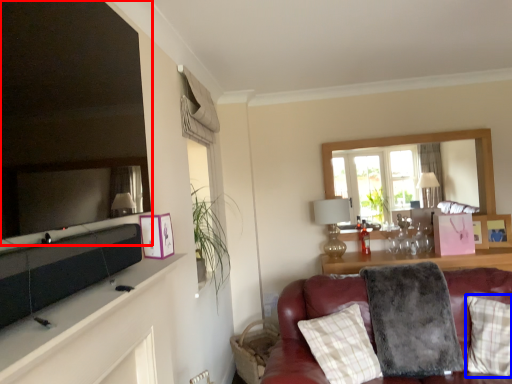
Question: Which point is closer to the camera, mirror (highlighted by a red box) or pillow (highlighted by a blue box)?

Choices:
 (A) mirror
 (B) pillow

Answer: (A)